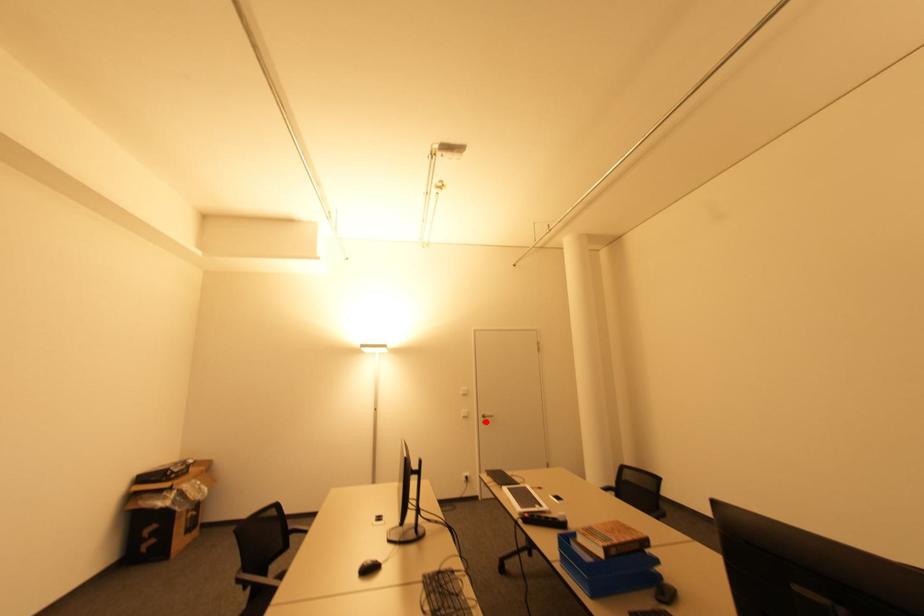
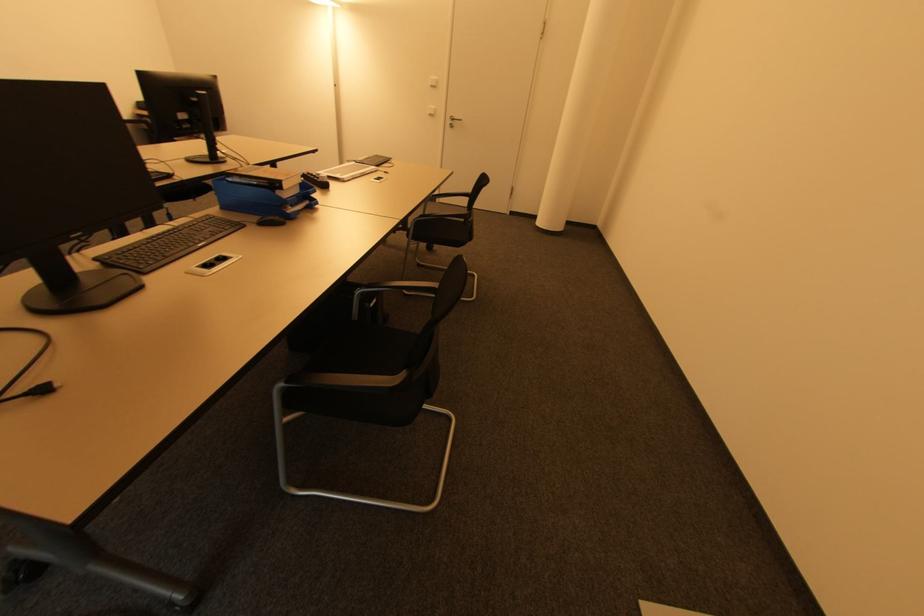
In the second image, find the point that corresponds to the highlighted location in the first image.

(454, 127)